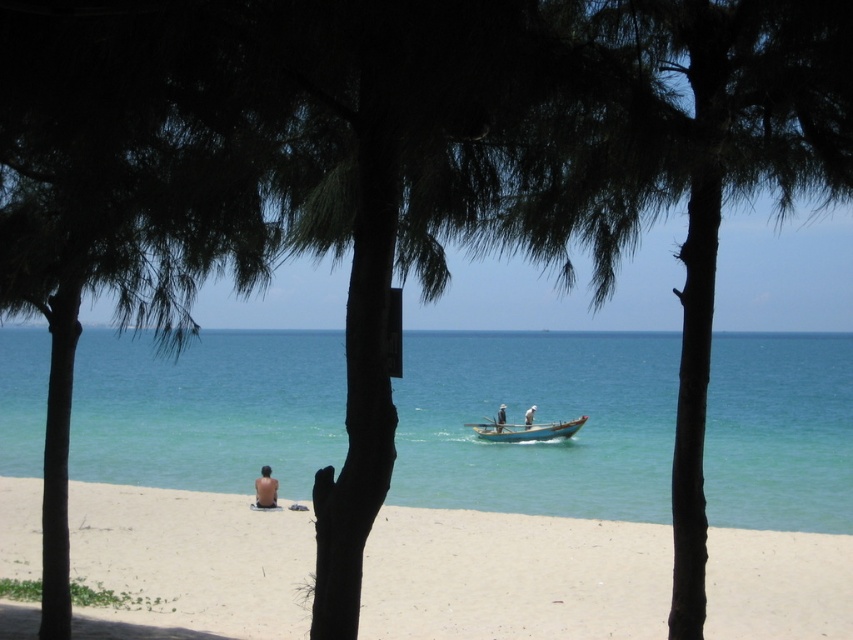
Looking at this image, you are standing at the center of the beach scene. You want to walk directly towards the clear blue water at center. Which direction should you walk?

Since the clear blue water at center is located at coordinates (538, 420) in the image, you should walk towards the lower right direction to reach it.

You are planning to set up a small tent for a beach picnic. The tent requires a space wider than the wooden boat at center. Can the white sandy beach at lower center provide enough width for your tent?

The white sandy beach at lower center is wider than the wooden boat at center, so yes, the beach has sufficient width to accommodate the tent required space.